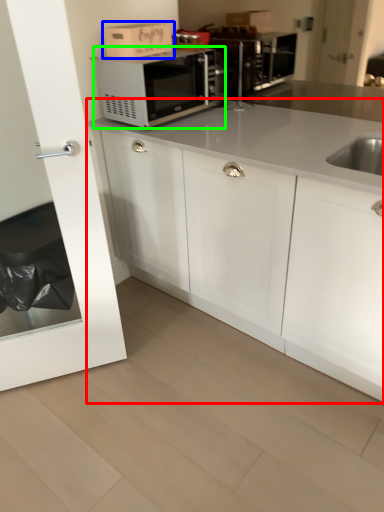
Question: Which is farther away from cabinetry (highlighted by a red box)? cardboard box (highlighted by a blue box) or microwave oven (highlighted by a green box)?

Choices:
 (A) cardboard box
 (B) microwave oven

Answer: (A)